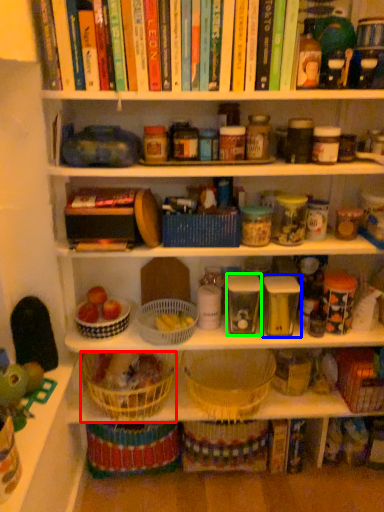
Question: Which is farther away from basket (highlighted by a red box)? glass jar (highlighted by a blue box) or glass jar (highlighted by a green box)?

Choices:
 (A) glass jar
 (B) glass jar

Answer: (A)